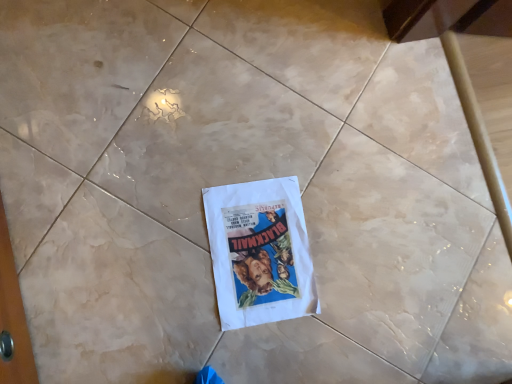
Locate an element on the screen. vacant region below white paper flyer at center (from a real-world perspective) is located at coordinates (260, 253).